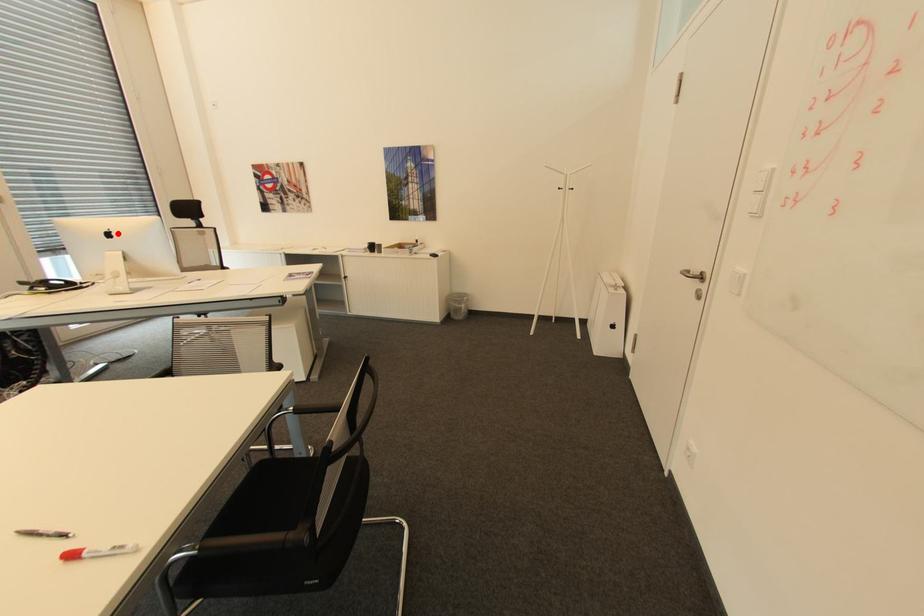
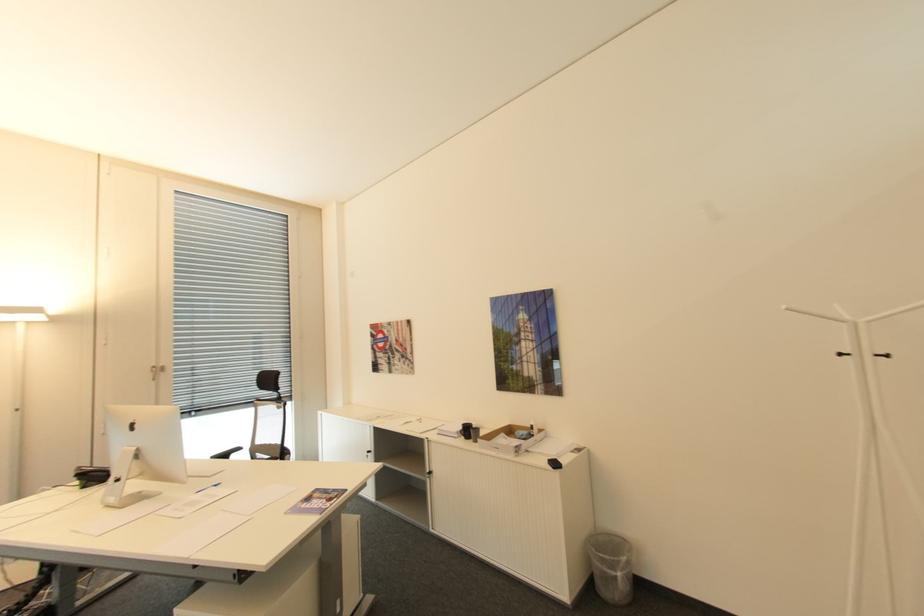
Locate, in the second image, the point that corresponds to the highlighted location in the first image.

(140, 426)